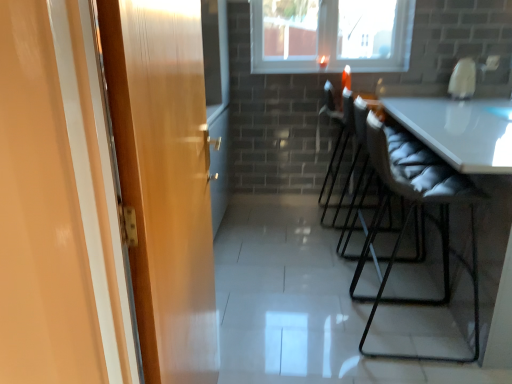
The height and width of the screenshot is (384, 512). In order to click on vacant area that lies in front of matte gray chair at center right, the second chair when ordered from front to back in this screenshot , I will do `click(354, 272)`.